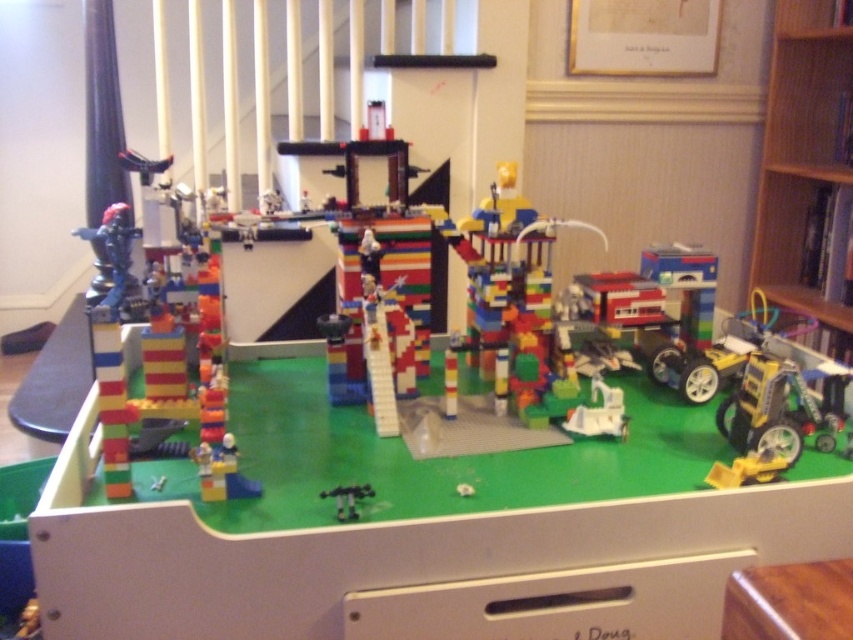
Question: Does wooden bookshelf at right come behind black plastic toy at center?

Choices:
 (A) yes
 (B) no

Answer: (A)

Question: Is wooden bookshelf at right to the right of black plastic toy at center from the viewer's perspective?

Choices:
 (A) yes
 (B) no

Answer: (A)

Question: Which point is closer to the camera?

Choices:
 (A) wooden bookshelf at right
 (B) black plastic toy at center

Answer: (B)

Question: Can you confirm if wooden bookshelf at right is positioned above black plastic toy at center?

Choices:
 (A) no
 (B) yes

Answer: (B)